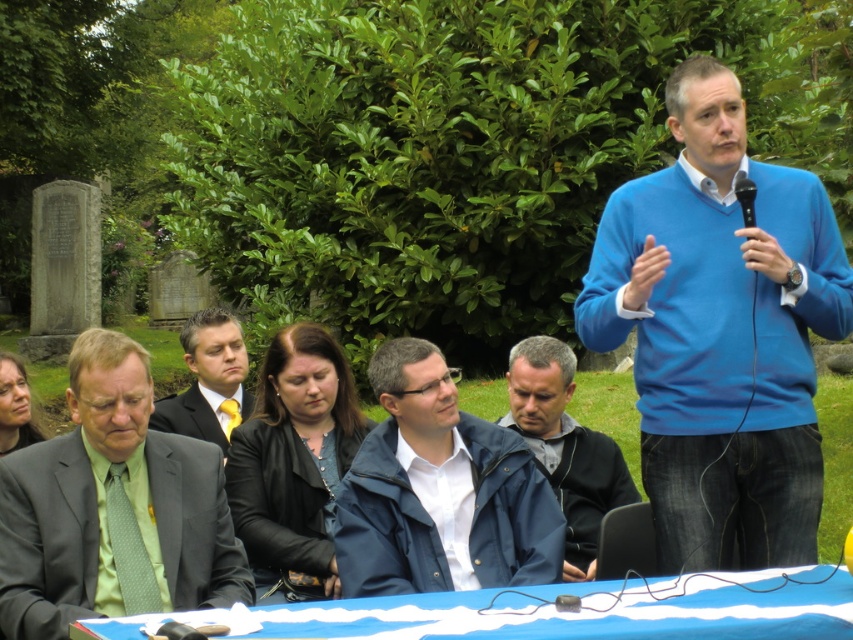
You are attending a professional event and need to locate the speaker. The speaker is wearing a dark suit at center and using a black plastic microphone at upper right. Based on their positions, where would the speaker most likely be seated relative to the microphone?

The dark suit at center is located below the black plastic microphone at upper right, so the speaker wearing the dark suit at center is seated below the microphone at upper right.

Based on the photo, you are organizing a professional event and need to arrange seating based on the attendees clothing. You see a green silk tie at left and a black leather jacket at center. Which clothing item is located to the left of the other?

The green silk tie at left is positioned on the left side of black leather jacket at center.